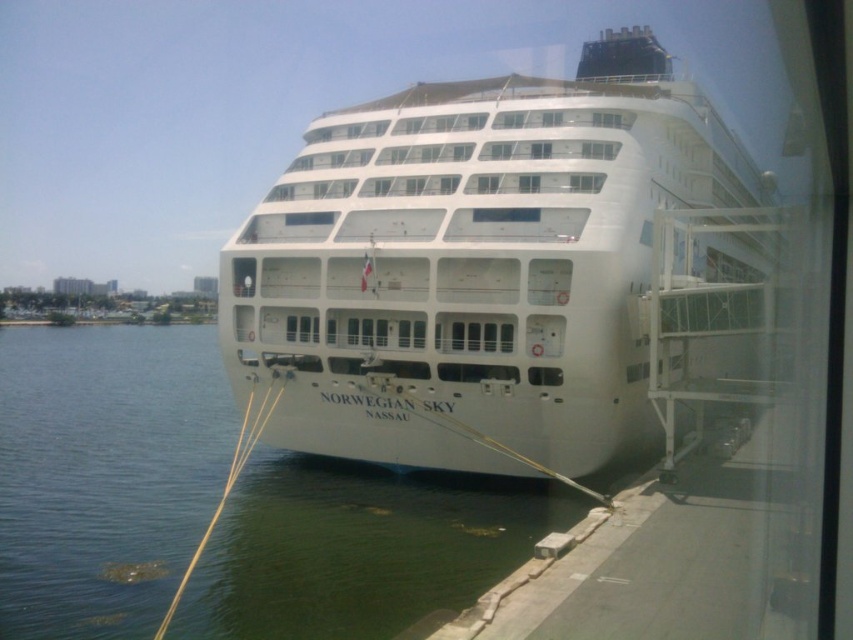
Is point (433, 333) in front of point (424, 500)?

That is True.

Can you confirm if white glossy cruise ship at center is wider than clear water at lower left?

No, white glossy cruise ship at center is not wider than clear water at lower left.

Which is in front, point (431, 467) or point (492, 545)?

Point (492, 545)

In order to click on white glossy cruise ship at center in this screenshot , I will do `click(477, 266)`.